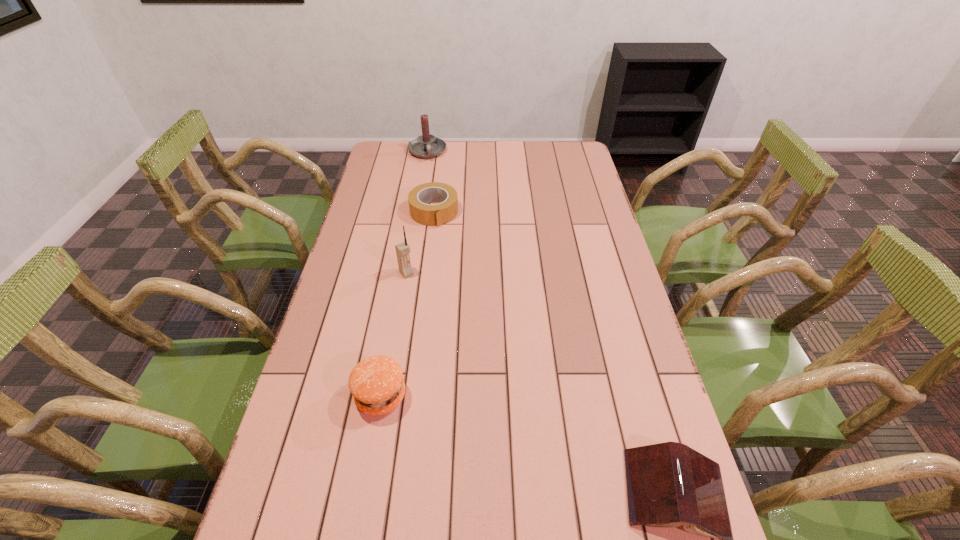
What are the coordinates of `free space located on the front of the cellular telephone, where the keypad is located` in the screenshot? It's located at (427, 300).

At what (x,y) coordinates should I click in order to perform the action: click on vacant region located 0.090m on the front of the cellular telephone, where the keypad is located. Please return your answer as a coordinate pair (x, y). Looking at the image, I should click on (424, 296).

The width and height of the screenshot is (960, 540). I want to click on vacant space located on the side of the farthest object with the handle loop, so click(x=433, y=180).

The height and width of the screenshot is (540, 960). In order to click on free spot located 0.380m on the side of the farthest object with the handle loop in this screenshot , I will do `click(442, 217)`.

The image size is (960, 540). Find the location of `free region located 0.200m on the side of the farthest object with the handle loop`. free region located 0.200m on the side of the farthest object with the handle loop is located at coordinates [x=435, y=189].

Locate an element on the screen. The width and height of the screenshot is (960, 540). object at the far edge is located at coordinates (425, 146).

Where is `patty that is at the left edge`? The width and height of the screenshot is (960, 540). patty that is at the left edge is located at coordinates (376, 383).

Find the location of a particular element. The width and height of the screenshot is (960, 540). candle that is at the left edge is located at coordinates (425, 146).

Find the location of a particular element. The height and width of the screenshot is (540, 960). object that is at the far left corner is located at coordinates (425, 146).

The height and width of the screenshot is (540, 960). In the image, there is a desktop. Find the location of `blank space at the far edge`. blank space at the far edge is located at coordinates [x=454, y=158].